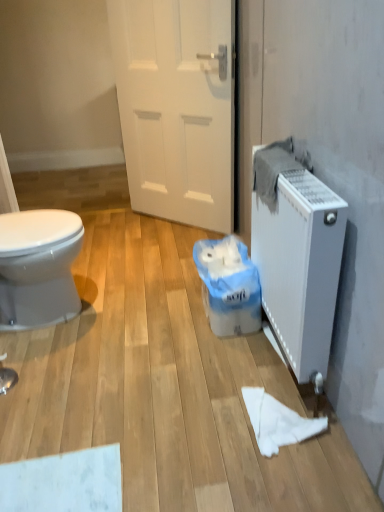
Find the location of a particular element. This screenshot has width=384, height=512. free space to the left of white matte radiator at right is located at coordinates (192, 361).